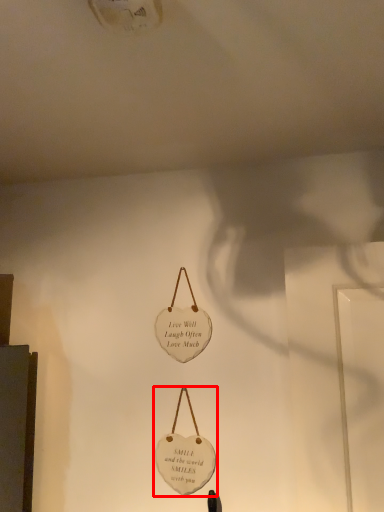
Question: From the image's perspective, where is handbag (annotated by the red box) located in relation to handbag in the image?

Choices:
 (A) above
 (B) below

Answer: (B)